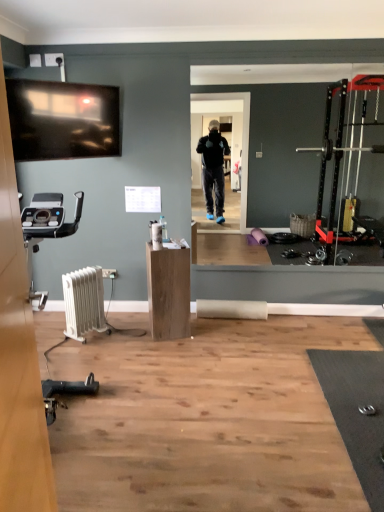
Question: Do you think wooden cabinet at center is within white plastic radiator at lower left, or outside of it?

Choices:
 (A) outside
 (B) inside

Answer: (A)

Question: Relative to white plastic radiator at lower left, is wooden cabinet at center in front or behind?

Choices:
 (A) behind
 (B) front

Answer: (A)

Question: From the image's perspective, relative to white plastic radiator at lower left, is wooden cabinet at center above or below?

Choices:
 (A) below
 (B) above

Answer: (B)

Question: Is white plastic radiator at lower left bigger or smaller than wooden cabinet at center?

Choices:
 (A) small
 (B) big

Answer: (A)

Question: From the image's perspective, is white plastic radiator at lower left above or below wooden cabinet at center?

Choices:
 (A) below
 (B) above

Answer: (A)

Question: Looking at their shapes, would you say white plastic radiator at lower left is wider or thinner than wooden cabinet at center?

Choices:
 (A) wide
 (B) thin

Answer: (B)

Question: Considering the relative positions of white plastic radiator at lower left and wooden cabinet at center in the image provided, is white plastic radiator at lower left to the left or to the right of wooden cabinet at center?

Choices:
 (A) left
 (B) right

Answer: (A)